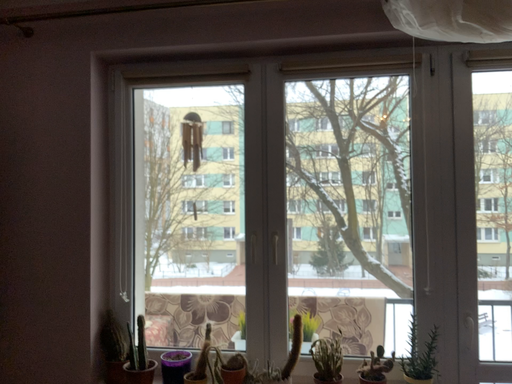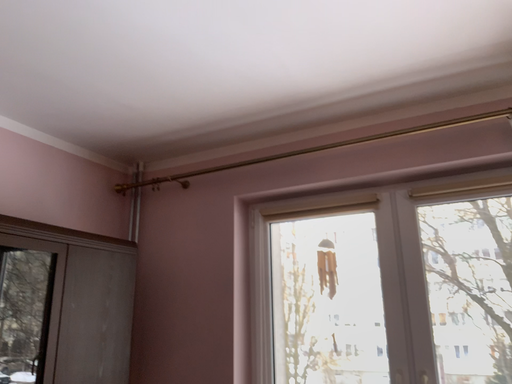
Question: Which way did the camera rotate in the video?

Choices:
 (A) rotated right
 (B) rotated left

Answer: (B)